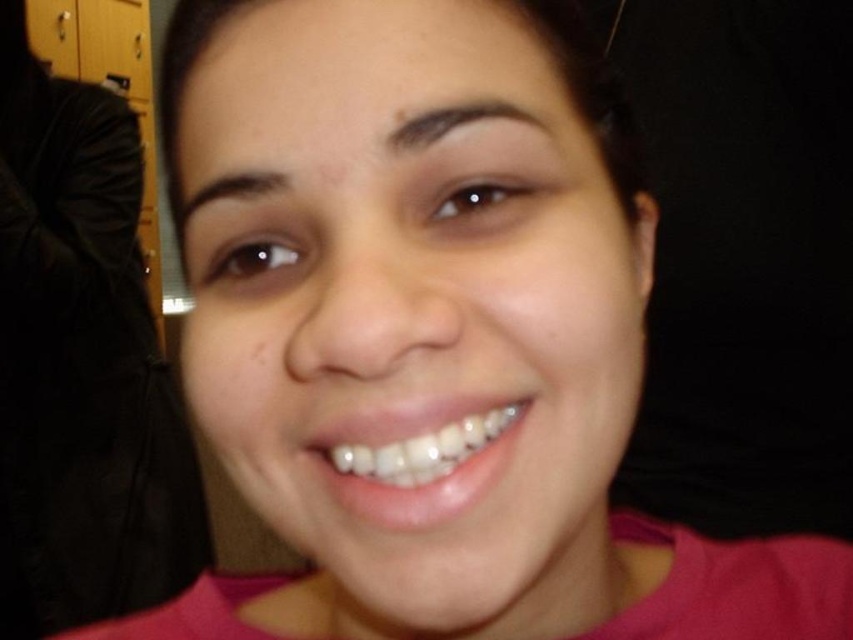
Question: Can you confirm if pink matte shirt at center is positioned above white glossy teeth at center?

Choices:
 (A) no
 (B) yes

Answer: (B)

Question: Which of the following is the closest to the observer?

Choices:
 (A) white glossy teeth at center
 (B) pink matte shirt at center

Answer: (A)

Question: Does pink matte shirt at center appear under white glossy teeth at center?

Choices:
 (A) yes
 (B) no

Answer: (B)

Question: Among these points, which one is farthest from the camera?

Choices:
 (A) (360, 467)
 (B) (97, 396)

Answer: (B)

Question: Among these objects, which one is nearest to the camera?

Choices:
 (A) white glossy teeth at center
 (B) pink matte shirt at center

Answer: (A)

Question: Observing the image, what is the correct spatial positioning of pink matte shirt at center in reference to white glossy teeth at center?

Choices:
 (A) below
 (B) above

Answer: (B)